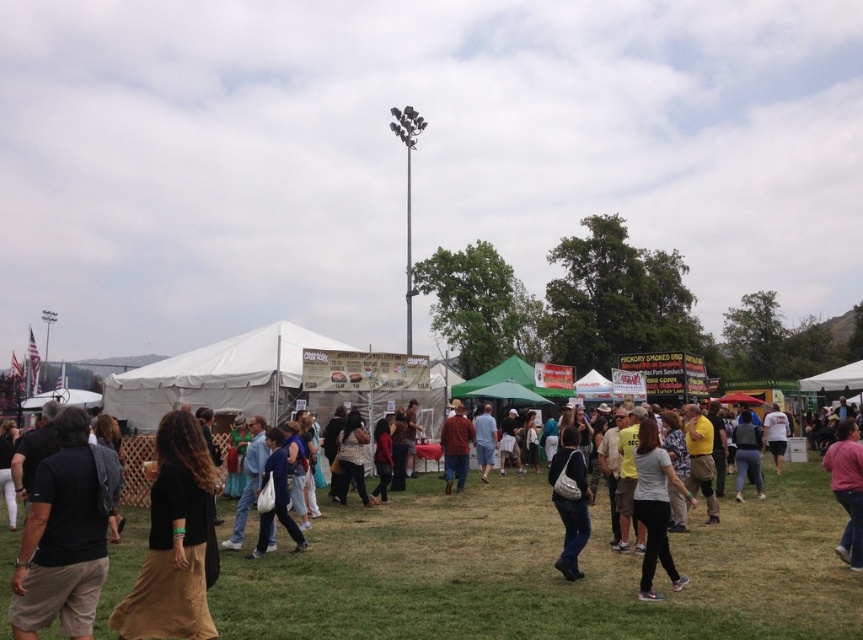
Question: Which point appears closest to the camera in this image?

Choices:
 (A) (162, 420)
 (B) (836, 467)
 (C) (458, 461)
 (D) (666, 557)

Answer: (A)

Question: Does matte red shirt at center appear on the right side of denim shorts at center?

Choices:
 (A) no
 (B) yes

Answer: (A)

Question: Among these points, which one is nearest to the camera?

Choices:
 (A) (746, 444)
 (B) (647, 444)

Answer: (B)

Question: Which object appears farthest from the camera in this image?

Choices:
 (A) denim shorts at center
 (B) black cotton shirt at left
 (C) white matte shirt at center
 (D) black cotton shirt at center

Answer: (A)

Question: Is white matte shirt at center in front of pink matte shirt at lower right?

Choices:
 (A) yes
 (B) no

Answer: (A)

Question: Does matte black pants at center appear under dark gray fabric pants at lower right?

Choices:
 (A) yes
 (B) no

Answer: (B)